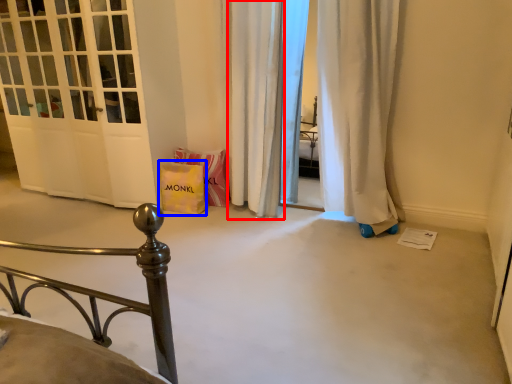
Question: Which object is closer to the camera taking this photo, curtain (highlighted by a red box) or gift bag (highlighted by a blue box)?

Choices:
 (A) curtain
 (B) gift bag

Answer: (A)